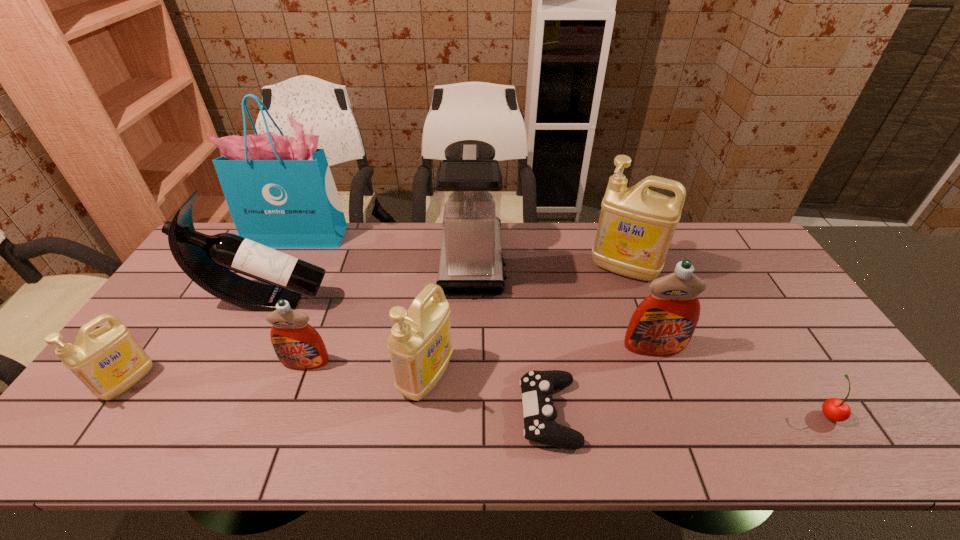
Find the location of a particular element. The width and height of the screenshot is (960, 540). free location at the far edge is located at coordinates (x=555, y=233).

At what (x,y) coordinates should I click in order to perform the action: click on free spot at the near edge of the desktop. Please return your answer as a coordinate pair (x, y). This screenshot has height=540, width=960. Looking at the image, I should click on (228, 441).

The height and width of the screenshot is (540, 960). In the image, there is a desktop. What are the coordinates of `vacant space at the left edge` in the screenshot? It's located at (167, 376).

This screenshot has width=960, height=540. I want to click on vacant space at the near left corner, so click(91, 443).

You are a GUI agent. You are given a task and a screenshot of the screen. Output one action in this format:
    pyautogui.click(x=<x>, y=<y>)
    Task: Click on the vacant space at the far right corner
    
    Given the screenshot: What is the action you would take?
    pyautogui.click(x=706, y=233)

Locate an element on the screen. The image size is (960, 540). vacant space that's between the black control and the ninth tallest object is located at coordinates (688, 413).

This screenshot has height=540, width=960. Identify the location of free space between the cherry and the tallest detergent. coord(726,341).

Locate an element on the screen. unoccupied area between the seventh object from left to right and the bigger red detergent is located at coordinates (601, 380).

Where is `free space that is in between the black control and the tallest detergent`? free space that is in between the black control and the tallest detergent is located at coordinates (587, 341).

This screenshot has height=540, width=960. Identify the location of vacant area between the tallest object and the leftmost object. (214, 309).